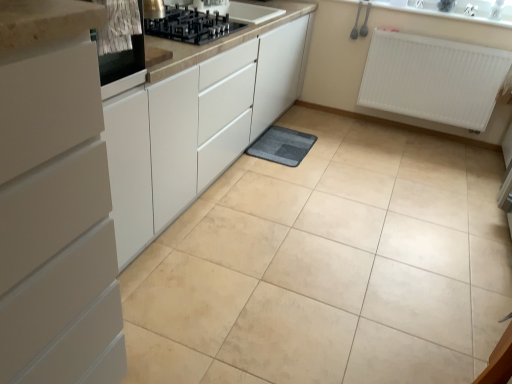
Question: From the image's perspective, relative to black glass gas stove at upper center, is gray soft mat at center above or below?

Choices:
 (A) above
 (B) below

Answer: (B)

Question: Looking at their shapes, would you say gray soft mat at center is wider or thinner than black glass gas stove at upper center?

Choices:
 (A) thin
 (B) wide

Answer: (A)

Question: Which object is the farthest from the white matte cabinet at left?

Choices:
 (A) black glass gas stove at upper center
 (B) gray soft mat at center
 (C) metallic stainless steel oven at upper left
 (D) white plastic radiator at upper right

Answer: (D)

Question: Which object is the farthest from the gray soft mat at center?

Choices:
 (A) metallic stainless steel oven at upper left
 (B) white plastic radiator at upper right
 (C) white matte cabinet at left
 (D) black glass gas stove at upper center

Answer: (C)